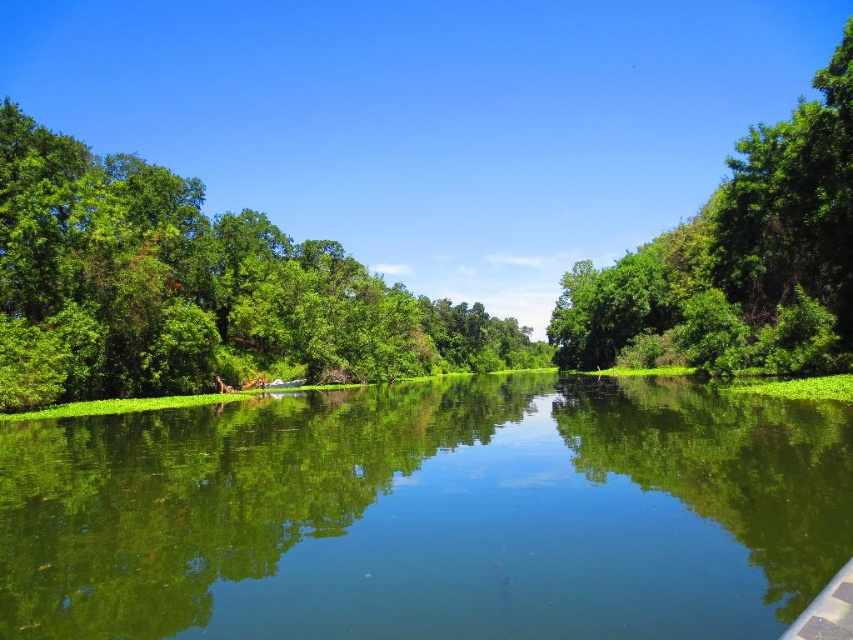
Question: Does green reflective water at center have a lesser width compared to green leafy tree at center?

Choices:
 (A) yes
 (B) no

Answer: (A)

Question: Which point appears farthest from the camera in this image?

Choices:
 (A) (798, 244)
 (B) (231, 276)

Answer: (B)

Question: Which object is closer to the camera taking this photo?

Choices:
 (A) green leafy tree at center
 (B) green reflective water at center

Answer: (B)

Question: Is green leafy tree at center to the left of green leafy tree at right from the viewer's perspective?

Choices:
 (A) yes
 (B) no

Answer: (A)

Question: Estimate the real-world distances between objects in this image. Which object is closer to the green leafy tree at center?

Choices:
 (A) green reflective water at center
 (B) green leafy tree at right

Answer: (B)

Question: Is green leafy tree at center above green leafy tree at right?

Choices:
 (A) no
 (B) yes

Answer: (A)